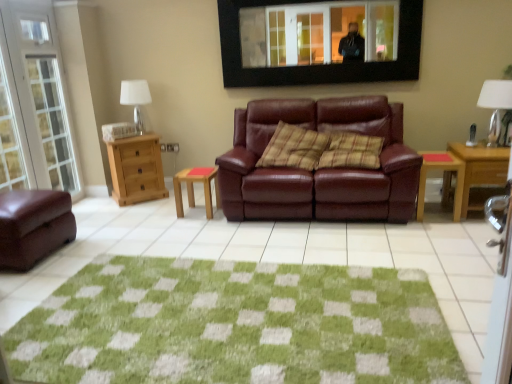
Where is `vacant area that is in front of wooden dresser at left`? vacant area that is in front of wooden dresser at left is located at coordinates (144, 208).